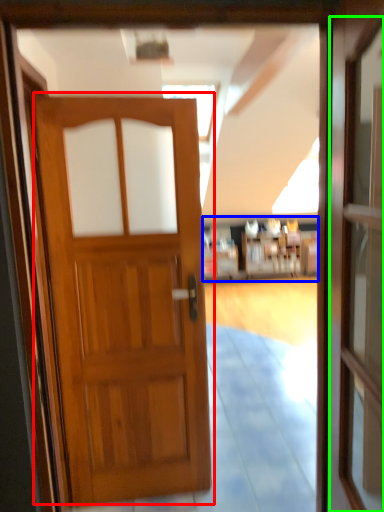
Question: Which object is the closest to the door (highlighted by a red box)? Choose among these: hotel lobby (highlighted by a blue box) or screen door (highlighted by a green box).

Choices:
 (A) hotel lobby
 (B) screen door

Answer: (B)